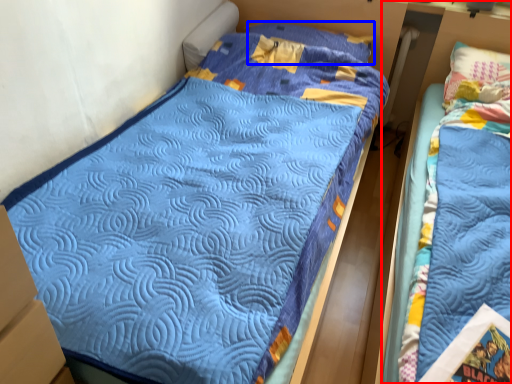
Question: Which object is closer to the camera taking this photo, bed (highlighted by a red box) or pillow (highlighted by a blue box)?

Choices:
 (A) bed
 (B) pillow

Answer: (A)